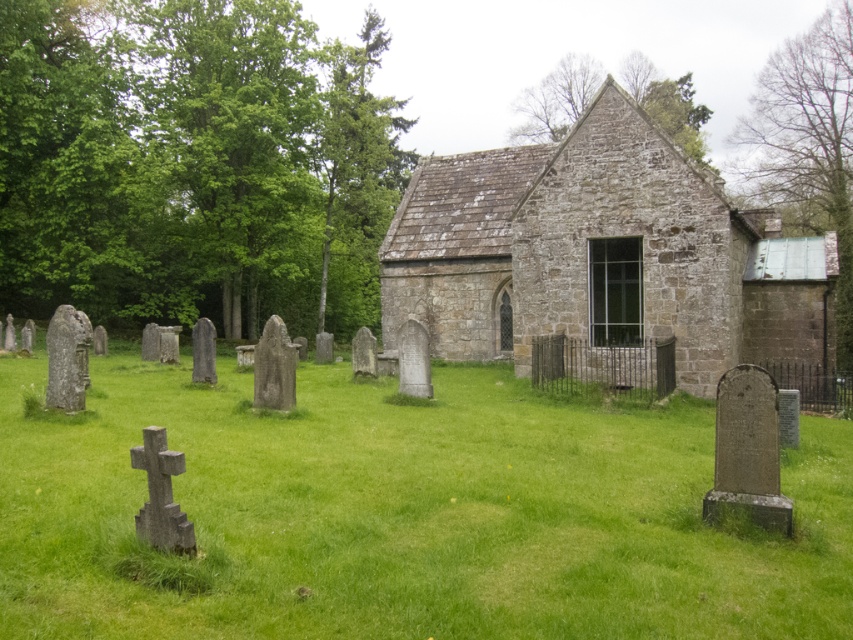
Who is more forward, (538, 168) or (157, 465)?

Point (157, 465) is more forward.

Which of these two, stone church at center or gray stone cross at lower left, stands taller?

stone church at center

The width and height of the screenshot is (853, 640). What are the coordinates of `stone church at center` in the screenshot? It's located at (602, 256).

Can you confirm if green leafy tree at upper right is positioned below gray stone cross at lower left?

Actually, green leafy tree at upper right is above gray stone cross at lower left.

Between green leafy tree at upper right and gray stone cross at lower left, which one is positioned higher?

Positioned higher is green leafy tree at upper right.

Is point (775, 61) more distant than point (167, 529)?

That is True.

Where is `green leafy tree at upper right`? The image size is (853, 640). green leafy tree at upper right is located at coordinates (808, 145).

Is green grass at center below green leafy tree at upper right?

Correct, green grass at center is located below green leafy tree at upper right.

Is point (672, 516) behind point (809, 88)?

No.

Is point (809, 518) farther from viewer compared to point (842, 120)?

No, (809, 518) is closer to viewer.

Locate an element on the screen. green grass at center is located at coordinates (403, 513).